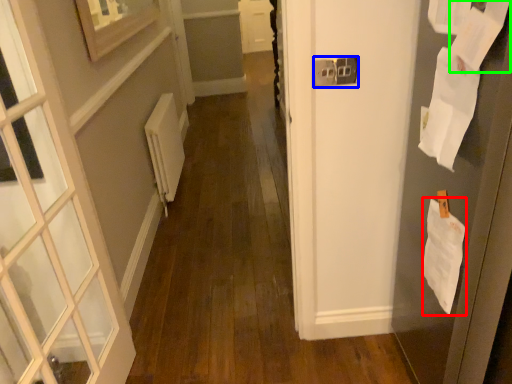
Question: Based on their relative distances, which object is nearer to paper (highlighted by a red box)? Choose from electric outlet (highlighted by a blue box) and paper (highlighted by a green box).

Choices:
 (A) electric outlet
 (B) paper

Answer: (B)